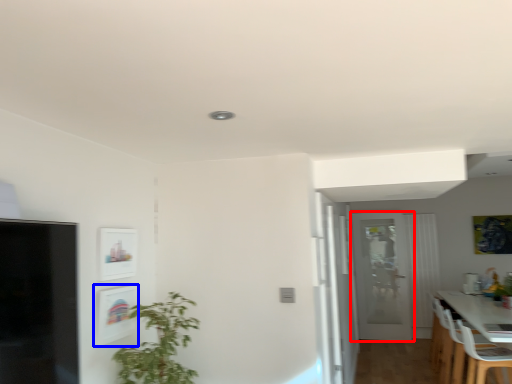
Question: Which of the following is the farthest to the observer, door (highlighted by a red box) or picture frame (highlighted by a blue box)?

Choices:
 (A) door
 (B) picture frame

Answer: (A)